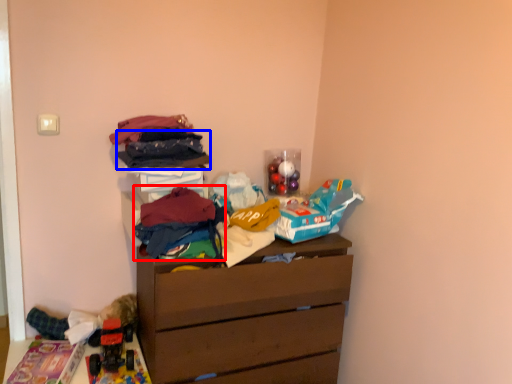
Question: Which of the following is the farthest to the observer, clothing (highlighted by a red box) or clothing (highlighted by a blue box)?

Choices:
 (A) clothing
 (B) clothing

Answer: (B)